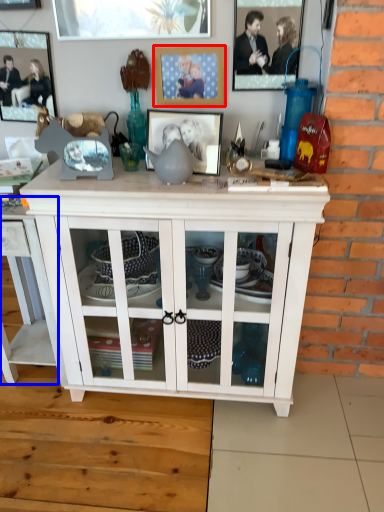
Question: Which object appears farthest to the camera in this image, picture frame (highlighted by a red box) or table (highlighted by a blue box)?

Choices:
 (A) picture frame
 (B) table

Answer: (A)